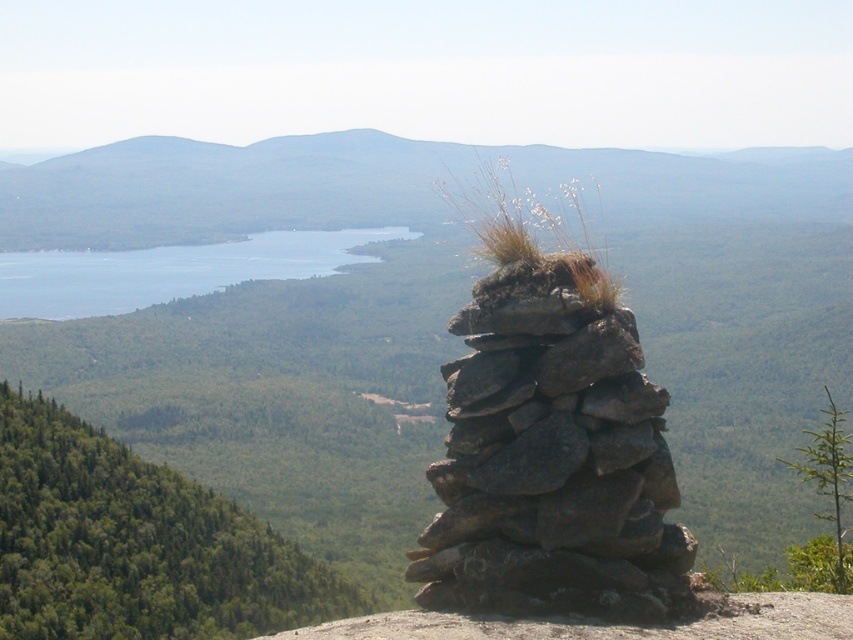
Question: Is gray rough stone stack at center above rocky outcrop at center?

Choices:
 (A) no
 (B) yes

Answer: (A)

Question: Considering the relative positions of rocky outcrop at center and blue water at center in the image provided, where is rocky outcrop at center located with respect to blue water at center?

Choices:
 (A) left
 (B) right

Answer: (B)

Question: Estimate the real-world distances between objects in this image. Which object is farther from the rocky outcrop at center?

Choices:
 (A) gray rough stone stack at center
 (B) blue water at center

Answer: (A)

Question: Which point appears farthest from the camera in this image?

Choices:
 (A) pos(196,177)
 (B) pos(209,257)
 (C) pos(492,449)

Answer: (A)

Question: Which is nearer to the gray rough stone stack at center?

Choices:
 (A) blue water at center
 (B) rocky outcrop at center

Answer: (A)

Question: Can you confirm if rocky outcrop at center is smaller than blue water at center?

Choices:
 (A) no
 (B) yes

Answer: (A)